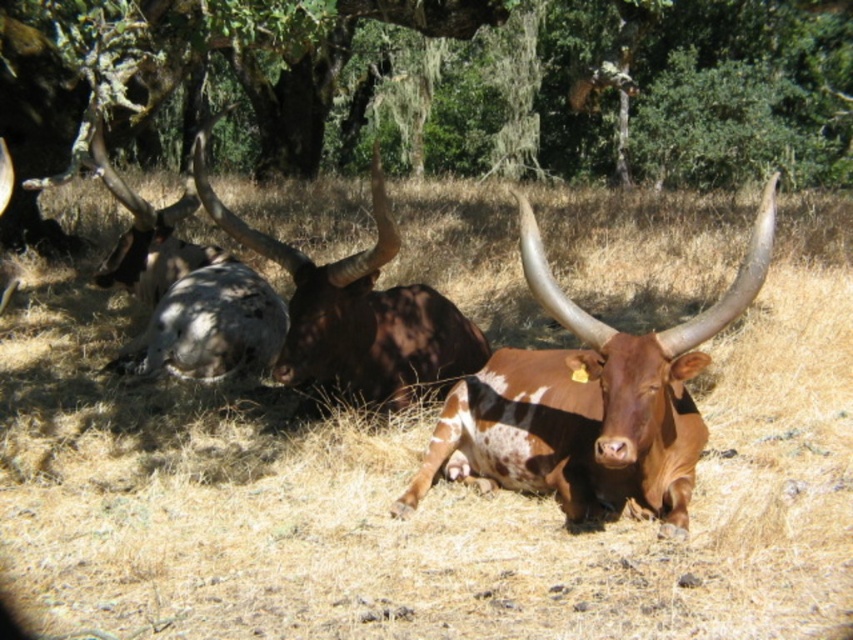
Can you confirm if brown rough textured bull at center is smaller than speckled fur at left?

Correct, brown rough textured bull at center occupies less space than speckled fur at left.

Is brown rough textured bull at center to the right of speckled fur at left from the viewer's perspective?

Indeed, brown rough textured bull at center is positioned on the right side of speckled fur at left.

Is point (444, 328) positioned after point (135, 250)?

No, (444, 328) is closer to viewer.

The height and width of the screenshot is (640, 853). I want to click on brown rough textured bull at center, so click(358, 314).

Between brown speckled hide at center and speckled fur at left, which one is positioned lower?

brown speckled hide at center is lower down.

Does point (459, 470) come in front of point (270, 296)?

Yes, point (459, 470) is in front of point (270, 296).

Which is behind, point (554, 362) or point (242, 371)?

The point (242, 371) is behind.

Identify the location of brown speckled hide at center. (589, 403).

Who is positioned more to the right, brown dry grass at center or green leafy tree at upper center?

Positioned to the right is green leafy tree at upper center.

Which is in front, point (299, 454) or point (383, 88)?

Point (299, 454) is in front.

What do you see at coordinates (427, 497) in the screenshot? The image size is (853, 640). I see `brown dry grass at center` at bounding box center [427, 497].

Locate an element on the screen. The width and height of the screenshot is (853, 640). brown dry grass at center is located at coordinates (427, 497).